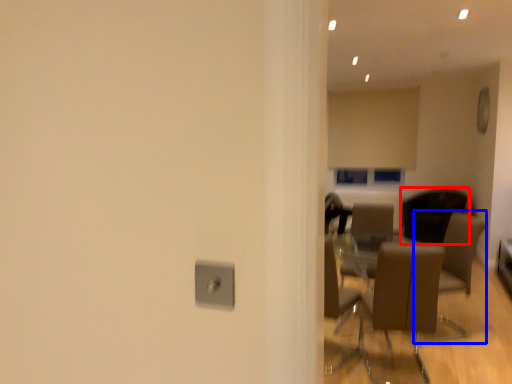
Question: Among these objects, which one is farthest to the camera, chair (highlighted by a red box) or armchair (highlighted by a blue box)?

Choices:
 (A) chair
 (B) armchair

Answer: (A)